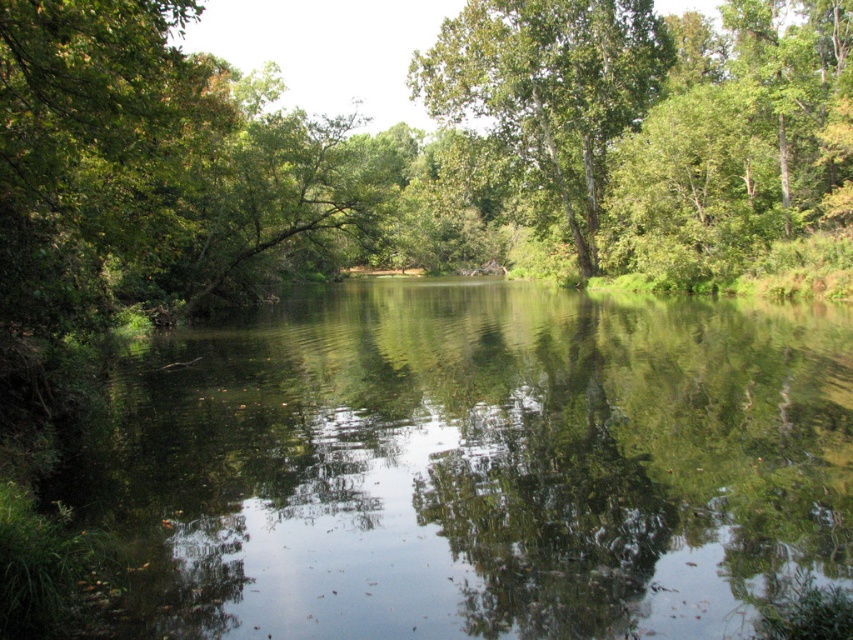
Is green reflective water at center positioned behind green leafy tree at center?

No, it is in front of green leafy tree at center.

You are a GUI agent. You are given a task and a screenshot of the screen. Output one action in this format:
    pyautogui.click(x=<x>, y=<y>)
    Task: Click on the green reflective water at center
    The image size is (853, 640).
    Given the screenshot: What is the action you would take?
    pyautogui.click(x=474, y=465)